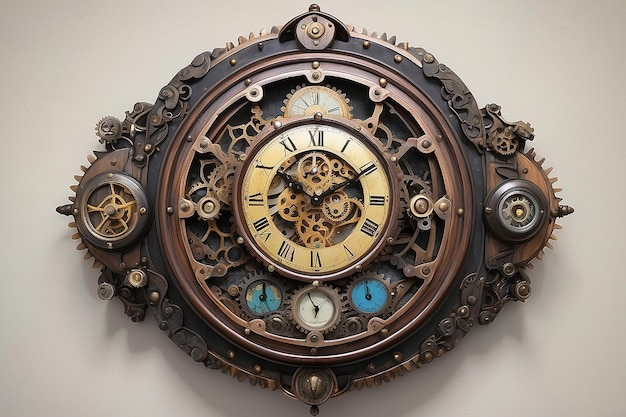
Identify the location of clock. The height and width of the screenshot is (417, 626). (313, 211).